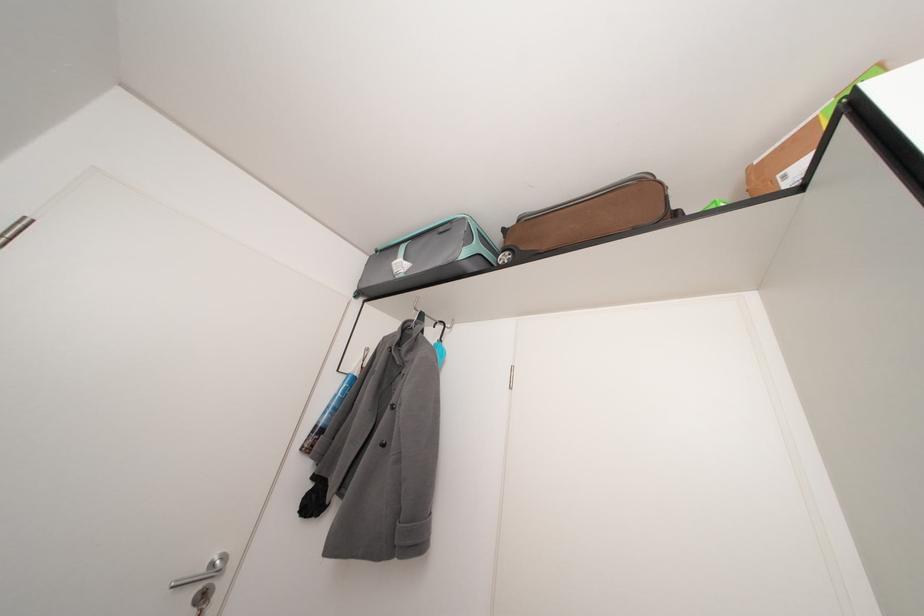
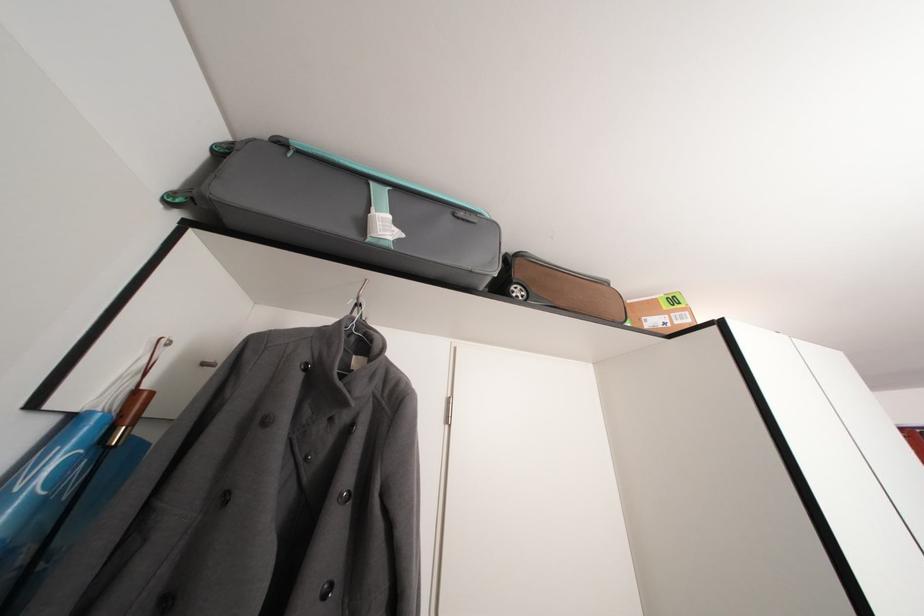
Question: The camera is either moving clockwise (left) or counter-clockwise (right) around the object. The first image is from the beginning of the video and the second image is from the end. Is the camera moving left or right when shooting the video?

Choices:
 (A) Left
 (B) Right

Answer: (A)